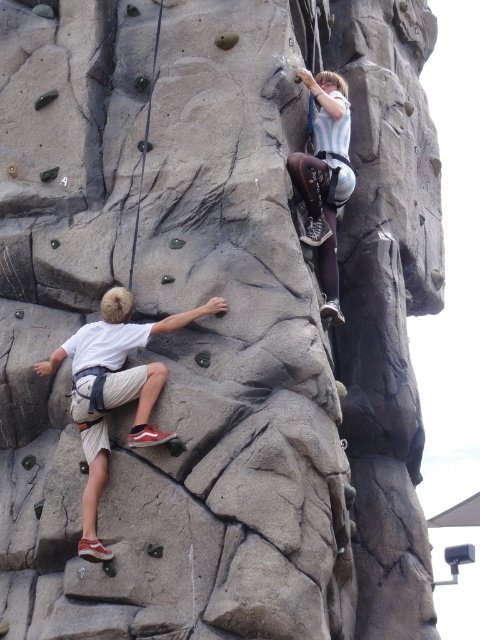
Question: Among these points, which one is nearest to the camera?

Choices:
 (A) (191, 317)
 (B) (311, 81)

Answer: (A)

Question: Does white cotton shirt at left appear under striped fabric shirt at upper right?

Choices:
 (A) no
 (B) yes

Answer: (B)

Question: Does white cotton shirt at left have a smaller size compared to striped fabric shirt at upper right?

Choices:
 (A) no
 (B) yes

Answer: (A)

Question: Among these points, which one is farthest from the camera?

Choices:
 (A) (295, 173)
 (B) (96, 342)

Answer: (A)

Question: Is white cotton shirt at left closer to camera compared to striped fabric shirt at upper right?

Choices:
 (A) no
 (B) yes

Answer: (B)